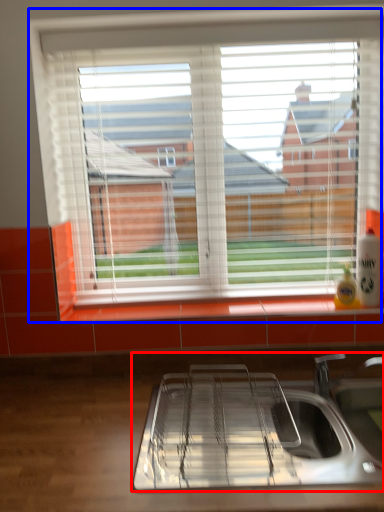
Question: Which point is further to the camera, sink (highlighted by a red box) or window (highlighted by a blue box)?

Choices:
 (A) sink
 (B) window

Answer: (B)